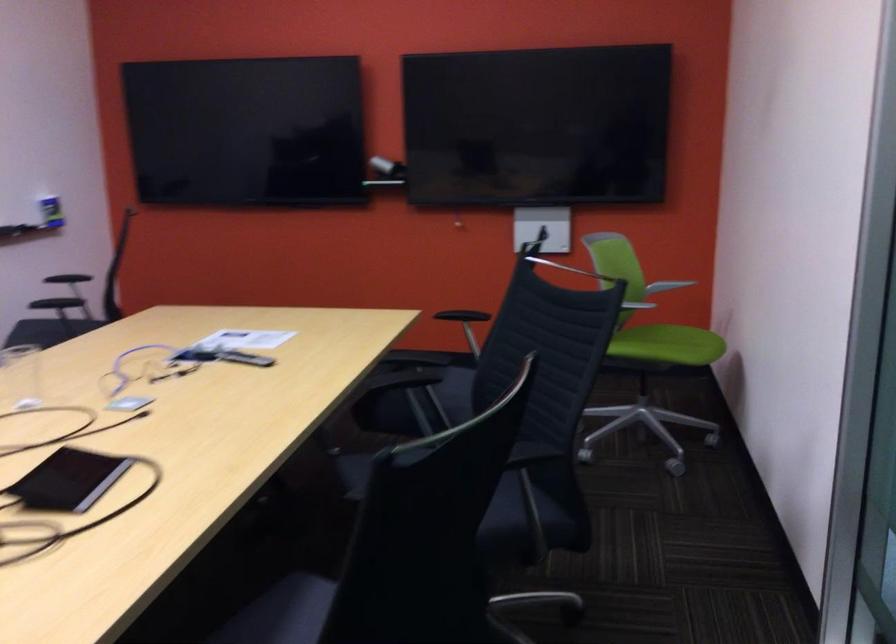
This screenshot has height=644, width=896. I want to click on green chair armrest, so click(x=666, y=286).